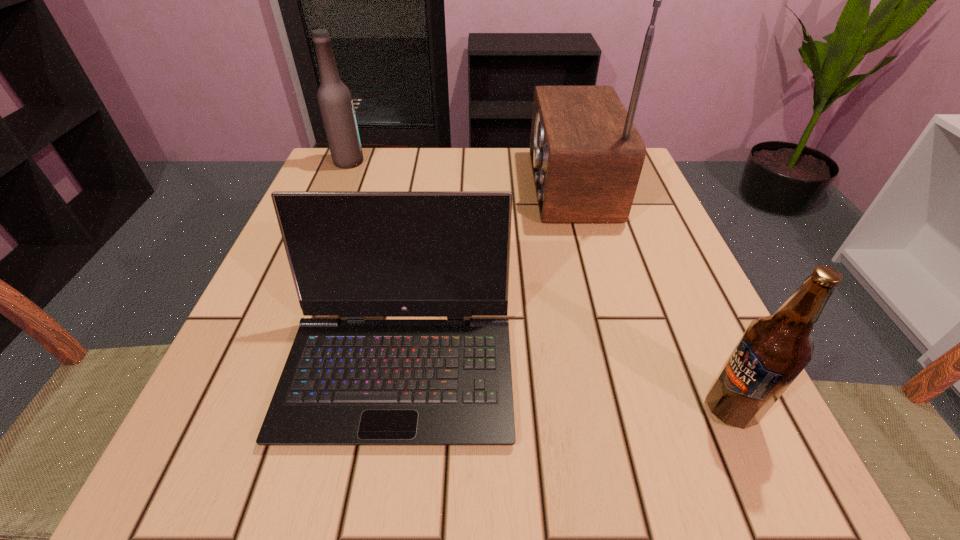
You are a GUI agent. You are given a task and a screenshot of the screen. Output one action in this format:
    pyautogui.click(x=<x>, y=<y>)
    Task: Click on the free region located 0.050m on the label of the farther beer bottle
    This screenshot has width=960, height=540.
    Given the screenshot: What is the action you would take?
    pyautogui.click(x=385, y=162)

This screenshot has width=960, height=540. What are the coordinates of `free location located 0.400m on the label of the shorter beer bottle` in the screenshot? It's located at (409, 409).

Where is `free space located on the label of the shorter beer bottle`? free space located on the label of the shorter beer bottle is located at coordinates (483, 409).

This screenshot has width=960, height=540. What are the coordinates of `vacant space located 0.220m on the label of the shorter beer bottle` in the screenshot? It's located at (542, 409).

You are a GUI agent. You are given a task and a screenshot of the screen. Output one action in this format:
    pyautogui.click(x=<x>, y=<y>)
    Task: Click on the radio receiver that is at the far edge
    This screenshot has width=960, height=540.
    Given the screenshot: What is the action you would take?
    pyautogui.click(x=586, y=154)

This screenshot has width=960, height=540. Find the location of `beer bottle that is at the far edge`. beer bottle that is at the far edge is located at coordinates (335, 102).

Locate an element on the screen. This screenshot has height=540, width=960. beer bottle that is at the near edge is located at coordinates (773, 351).

The width and height of the screenshot is (960, 540). Identify the location of laptop computer that is at the near edge. (346, 382).

This screenshot has width=960, height=540. Find the location of `beer bottle that is at the left edge`. beer bottle that is at the left edge is located at coordinates (335, 102).

Find the location of a particular element. laptop computer that is at the left edge is located at coordinates (346, 382).